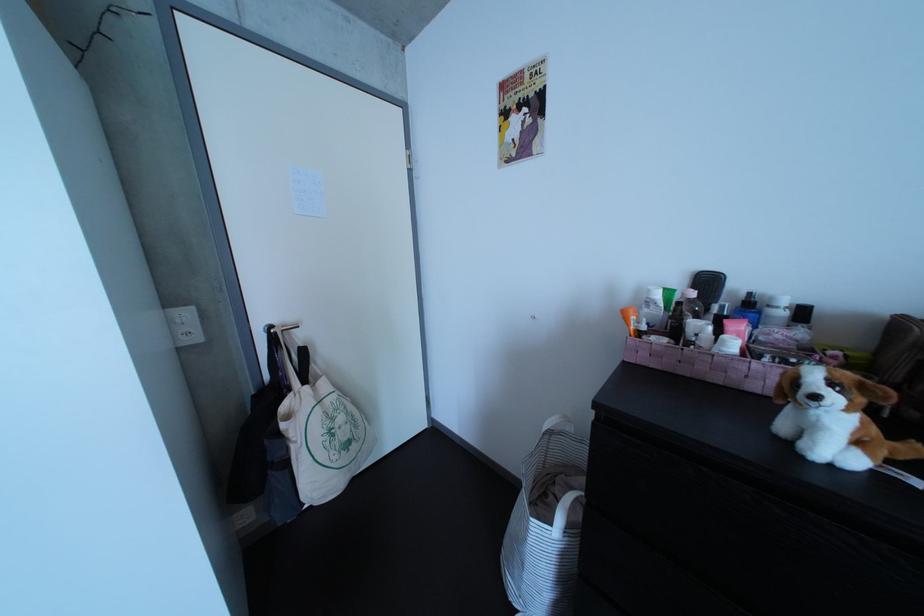
Where would you grip the black hairbrush handle? Please return your answer as a coordinate pair (x, y).

(709, 282)